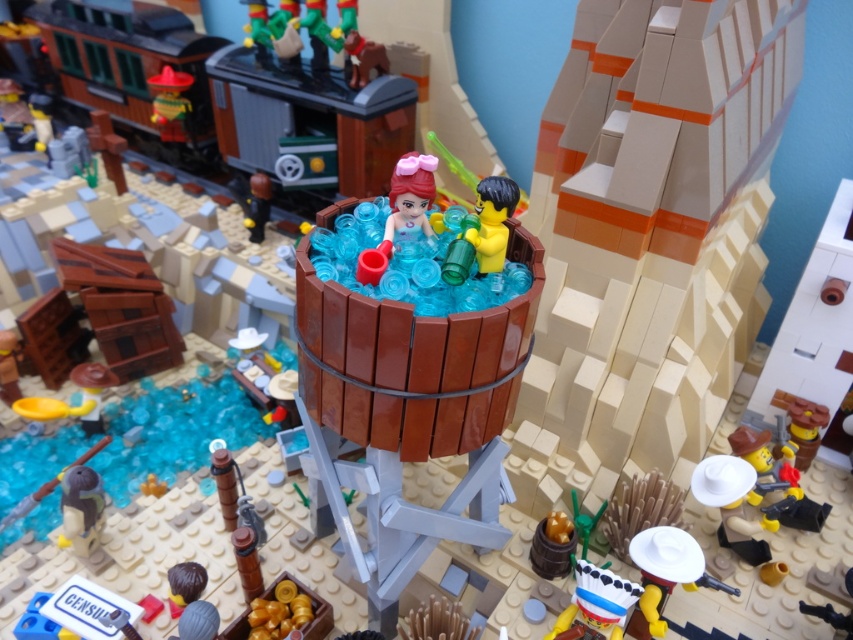
Question: Does wooden barrel at center appear on the right side of matte black train car at upper left?

Choices:
 (A) no
 (B) yes

Answer: (B)

Question: Can you confirm if translucent pink plastic figure at center is positioned above yellow matte minifigure at center?

Choices:
 (A) no
 (B) yes

Answer: (B)

Question: Among these points, which one is nearest to the camera?

Choices:
 (A) (322, 490)
 (B) (471, 236)

Answer: (B)

Question: Can you confirm if wooden barrel at center is thinner than yellow matte minifigure at center?

Choices:
 (A) yes
 (B) no

Answer: (B)

Question: Among these points, which one is farthest from the camera?

Choices:
 (A) click(x=492, y=262)
 (B) click(x=386, y=157)
 (C) click(x=421, y=168)
 (D) click(x=393, y=192)

Answer: (B)

Question: Estimate the real-world distances between objects in this image. Which object is closer to the wooden barrel at center?

Choices:
 (A) yellow matte minifigure at center
 (B) translucent pink plastic figure at center
 (C) matte black train car at upper left

Answer: (B)